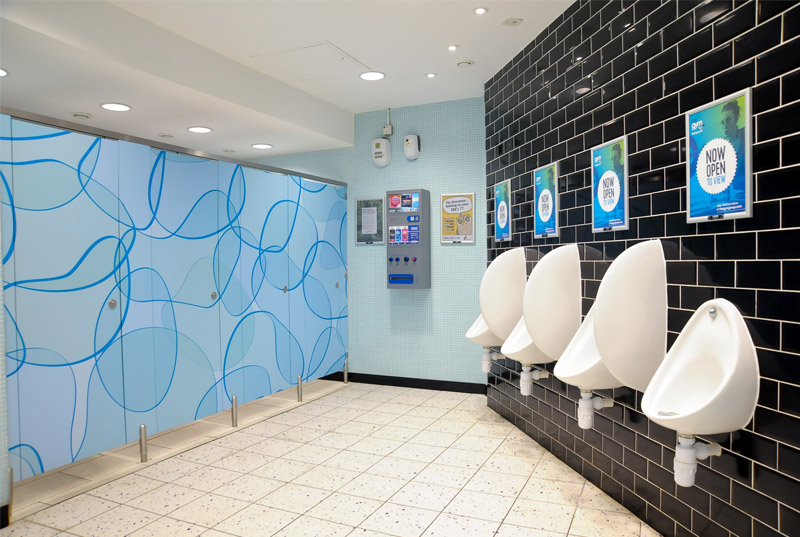
You are a GUI agent. You are given a task and a screenshot of the screen. Output one action in this format:
    pyautogui.click(x=<x>, y=<y>)
    Task: Click on the toilet door
    Image resolution: width=800 pixels, height=537 pixels.
    Given the screenshot: What is the action you would take?
    pyautogui.click(x=69, y=349), pyautogui.click(x=142, y=349), pyautogui.click(x=266, y=319), pyautogui.click(x=320, y=329)